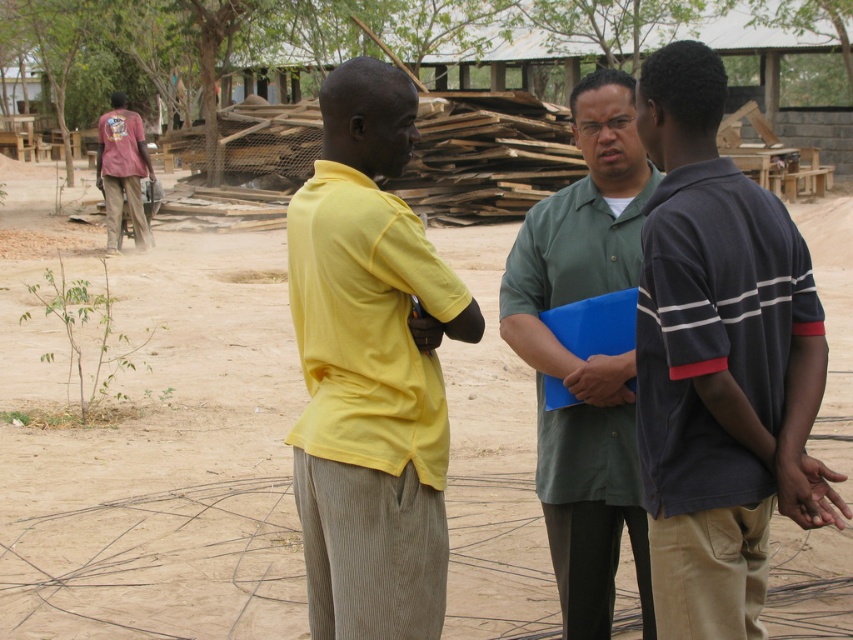
Does dark blue striped polo shirt at right have a larger size compared to brushed metal shirt at left?

Incorrect, dark blue striped polo shirt at right is not larger than brushed metal shirt at left.

Is dark blue striped polo shirt at right further to the viewer compared to brushed metal shirt at left?

No.

Find the location of a particular element. This screenshot has width=853, height=640. dark blue striped polo shirt at right is located at coordinates (718, 362).

Who is positioned more to the right, dark blue striped polo shirt at right or yellow cotton shirt at center?

Positioned to the right is dark blue striped polo shirt at right.

Does dark blue striped polo shirt at right have a smaller size compared to yellow cotton shirt at center?

No.

Identify the location of dark blue striped polo shirt at right. (718, 362).

Between green matte shirt at center and brushed metal shirt at left, which one is positioned higher?

brushed metal shirt at left is above.

Does point (592, 374) come in front of point (115, 122)?

Yes, point (592, 374) is closer to viewer.

The width and height of the screenshot is (853, 640). What are the coordinates of `green matte shirt at center` in the screenshot? It's located at (585, 358).